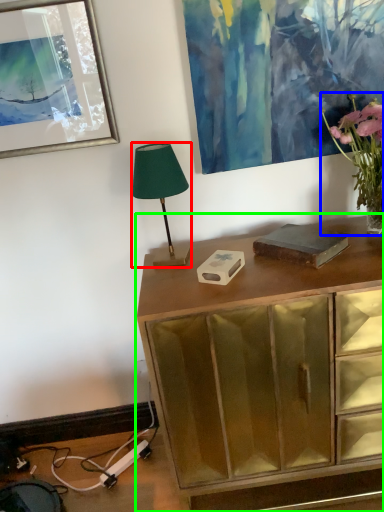
Question: Estimate the real-world distances between objects in this image. Which object is farther from lamp (highlighted by a red box), houseplant (highlighted by a blue box) or chest of drawers (highlighted by a green box)?

Choices:
 (A) houseplant
 (B) chest of drawers

Answer: (A)